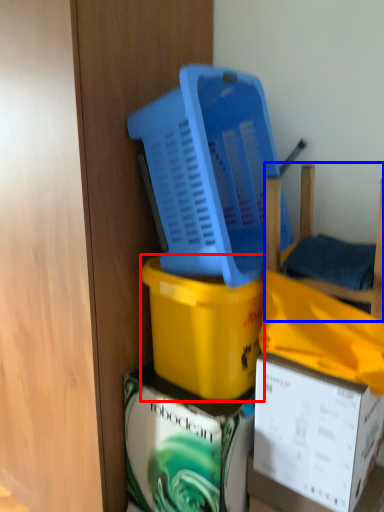
Question: Which point is closer to the camera, box (highlighted by a red box) or furniture (highlighted by a blue box)?

Choices:
 (A) box
 (B) furniture

Answer: (B)